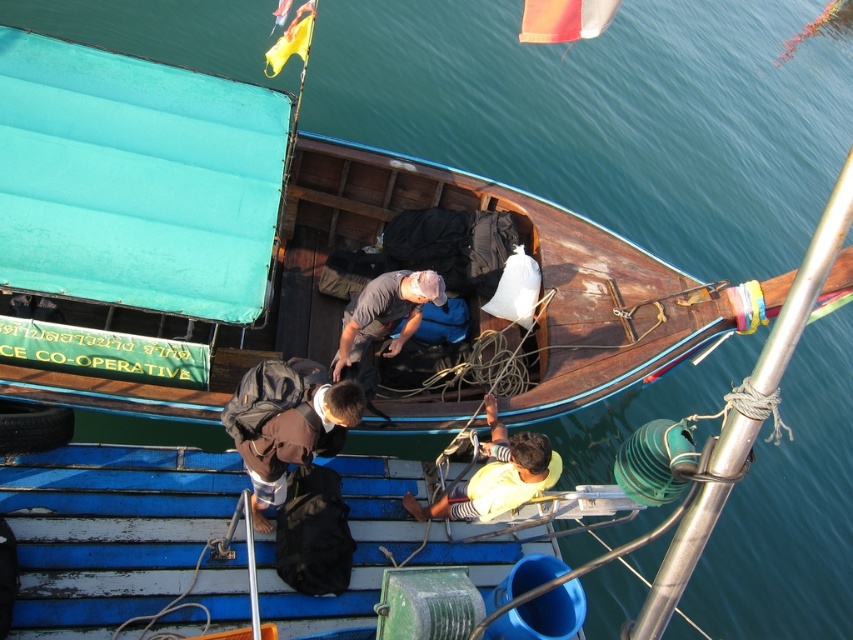
Who is more distant from viewer, (554, 461) or (364, 348)?

Point (364, 348)

Is yellow matte shirt at center to the left of gray matte shirt at center from the viewer's perspective?

Incorrect, yellow matte shirt at center is not on the left side of gray matte shirt at center.

At what (x,y) coordinates should I click in order to perform the action: click on yellow matte shirt at center. Please return your answer as a coordinate pair (x, y). The width and height of the screenshot is (853, 640). Looking at the image, I should click on (496, 476).

Find the location of `yellow matte shirt at center`. yellow matte shirt at center is located at coordinates (496, 476).